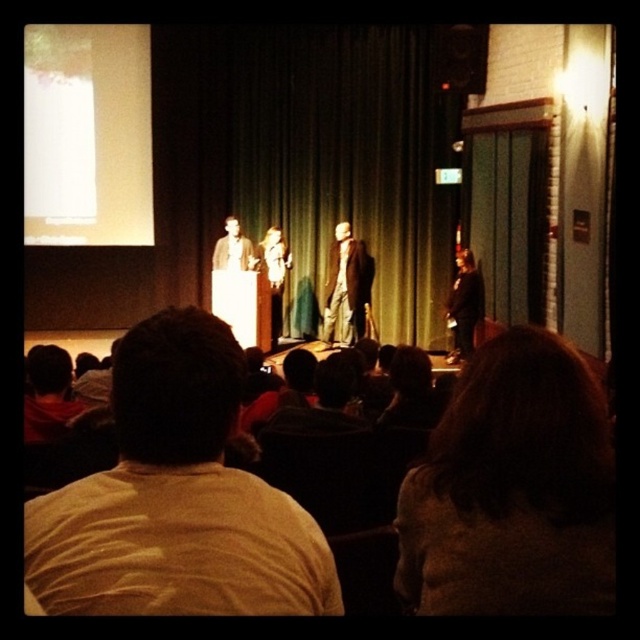
Question: Which point appears farthest from the camera in this image?

Choices:
 (A) (452, 316)
 (B) (179, 176)
 (C) (371, 282)
 (D) (458, 576)

Answer: (B)

Question: Which of the following is the closest to the observer?

Choices:
 (A) (236, 224)
 (B) (243, 125)
 (C) (326, 314)

Answer: (A)

Question: Is light brown fabric suit at center bigger than matte brown suit at center?

Choices:
 (A) yes
 (B) no

Answer: (A)

Question: Which point appears farthest from the camera in this image?

Choices:
 (A) (529, 554)
 (B) (353, 301)
 (C) (241, 113)
 (D) (474, 284)

Answer: (C)

Question: Is light beige shirt at center bigger than light brown fabric suit at center?

Choices:
 (A) no
 (B) yes

Answer: (A)

Question: Does green fabric curtain at center appear under matte brown suit at center?

Choices:
 (A) yes
 (B) no

Answer: (A)